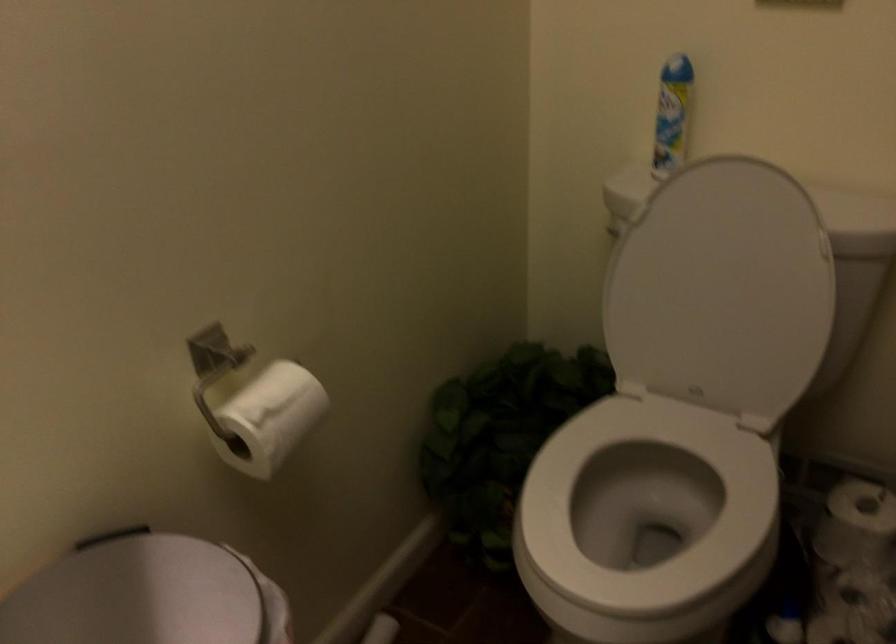
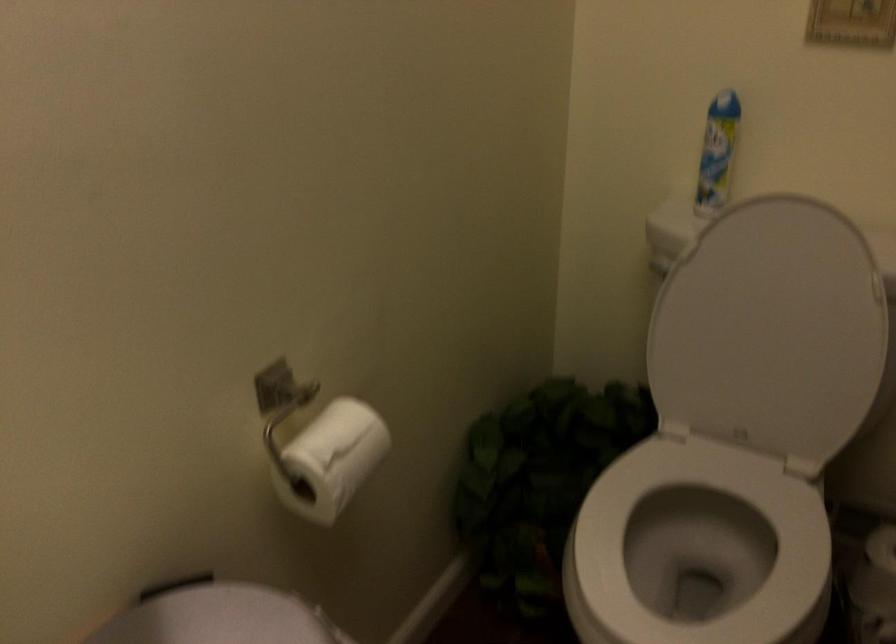
Locate, in the second image, the point that corresponds to point (657, 506) in the first image.

(698, 547)